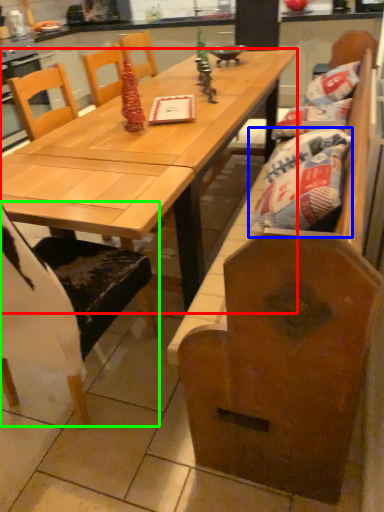
Question: Estimate the real-world distances between objects in this image. Which object is closer to table (highlighted by a red box), material (highlighted by a blue box) or chair (highlighted by a green box)?

Choices:
 (A) material
 (B) chair

Answer: (A)